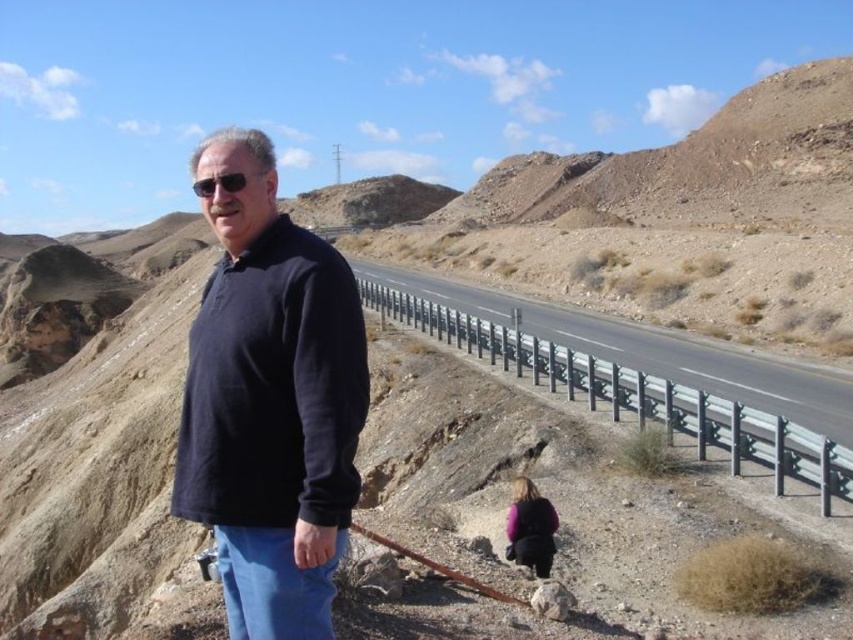
Question: Is dark blue fleece at center positioned in front of metallic gray highway at center?

Choices:
 (A) no
 (B) yes

Answer: (B)

Question: Can you confirm if dark blue fleece at center is bigger than metallic gray highway at center?

Choices:
 (A) no
 (B) yes

Answer: (B)

Question: Does dark blue fleece at center have a larger size compared to metallic gray highway at center?

Choices:
 (A) yes
 (B) no

Answer: (A)

Question: Which object is closer to the camera taking this photo?

Choices:
 (A) dark blue fleece at center
 (B) metallic gray highway at center

Answer: (A)